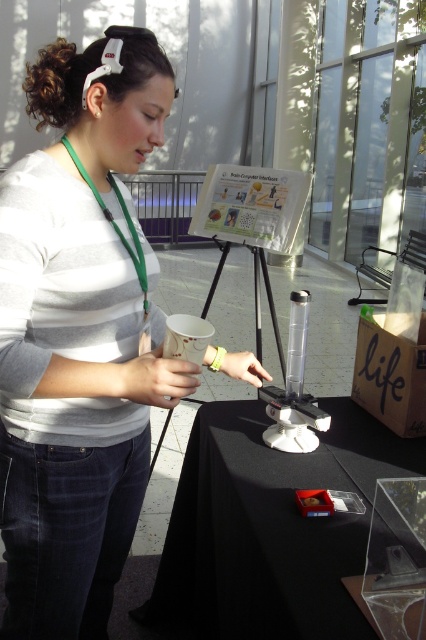
Question: Which point is closer to the camera?

Choices:
 (A) (279, 440)
 (B) (158, 81)

Answer: (B)

Question: Estimate the real-world distances between objects in this image. Which object is farther from the clear plastic tube at center?

Choices:
 (A) black matte table at center
 (B) white matte shirt at upper left

Answer: (B)

Question: Is black matte table at center to the left of clear plastic tube at center from the viewer's perspective?

Choices:
 (A) yes
 (B) no

Answer: (A)

Question: Which object is positioned closest to the white matte shirt at upper left?

Choices:
 (A) black matte table at center
 (B) clear plastic tube at center

Answer: (A)

Question: Is black matte table at center closer to camera compared to clear plastic tube at center?

Choices:
 (A) no
 (B) yes

Answer: (B)

Question: In this image, where is white matte shirt at upper left located relative to black matte table at center?

Choices:
 (A) right
 (B) left

Answer: (B)